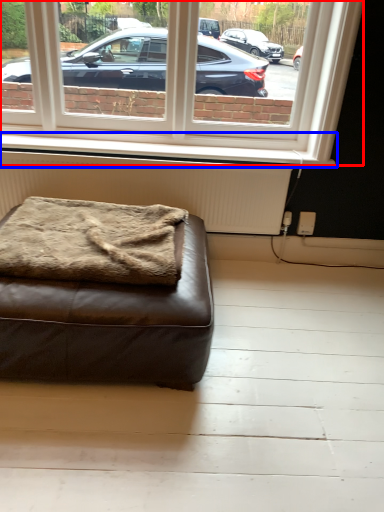
Question: Which of the following is the farthest to the observer, window (highlighted by a red box) or window sill (highlighted by a blue box)?

Choices:
 (A) window
 (B) window sill

Answer: (B)